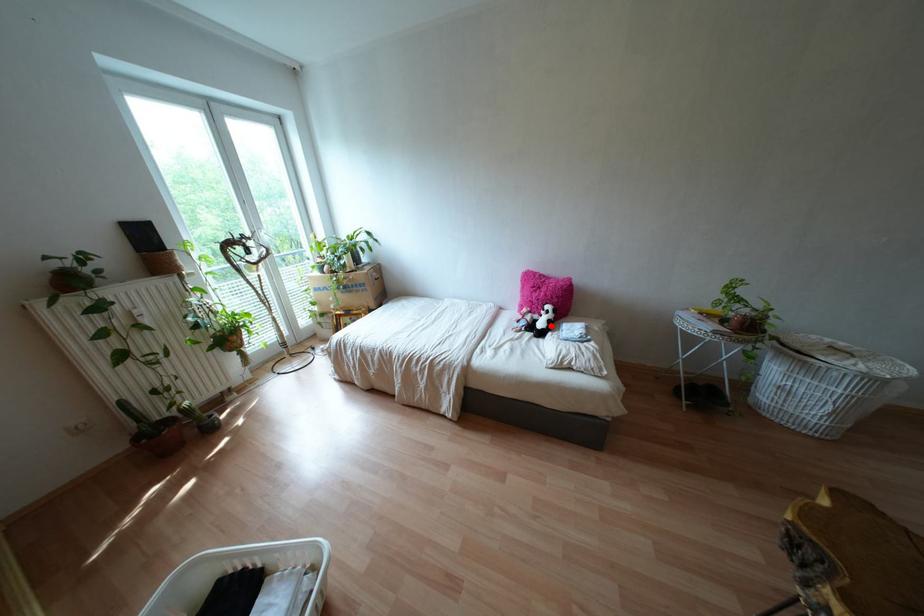
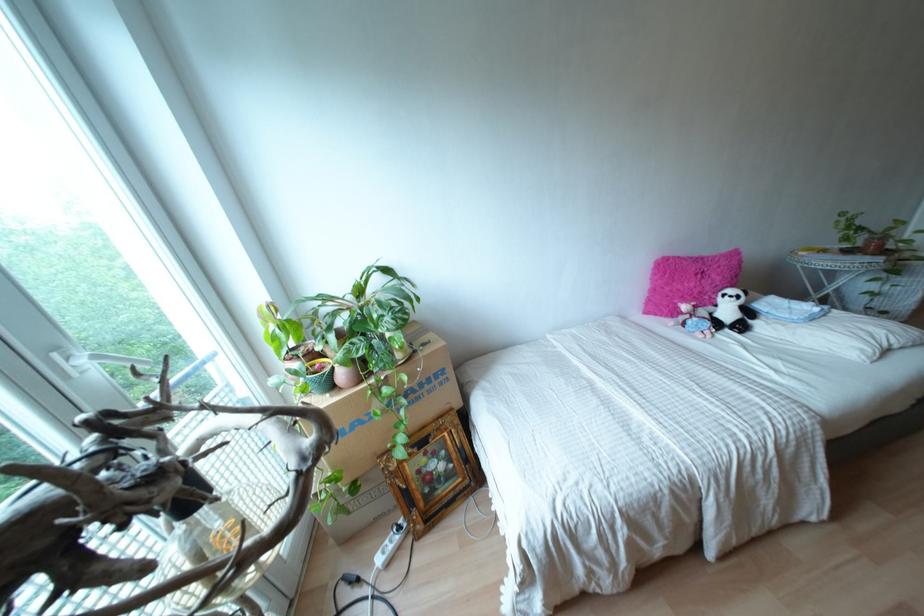
Question: I am providing you with two images of the same scene from different viewpoints. Image1 has a red point marked. In image2, the corresponding 3D location appears at what relative position? Reply with the corresponding letter.

Choices:
 (A) Closer
 (B) Farther

Answer: (B)